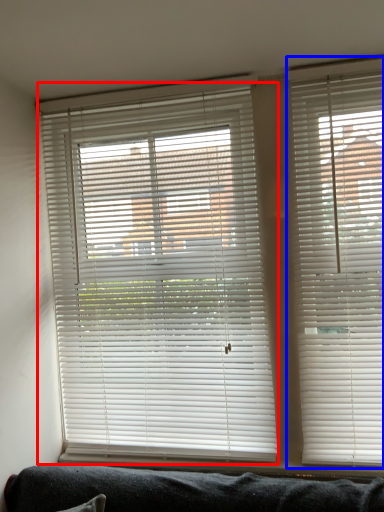
Question: Which object appears closest to the camera in this image, window blind (highlighted by a red box) or window blind (highlighted by a blue box)?

Choices:
 (A) window blind
 (B) window blind

Answer: (B)